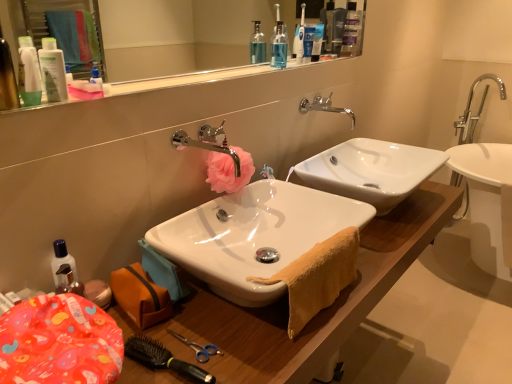
The image size is (512, 384). Identify the location of free space between yellow terry cloth towel at lower center and black plastic brush at lower left, placed as the second brush when sorted from front to back. (231, 332).